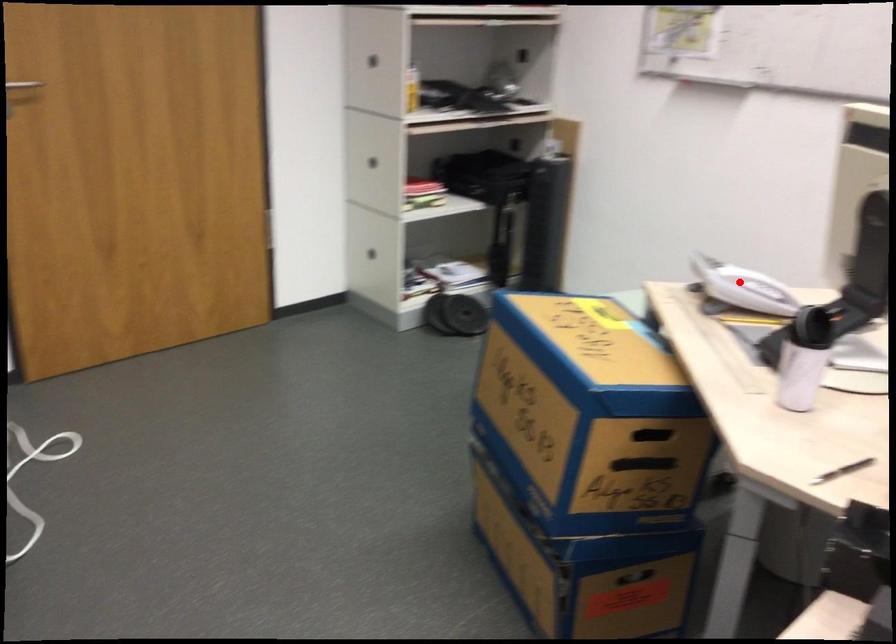
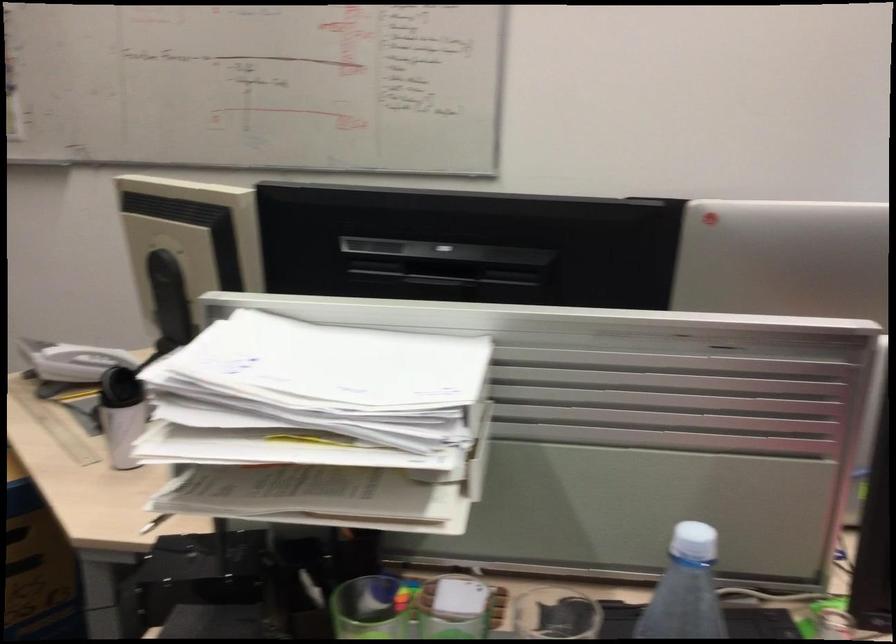
Where in the second image is the point corresponding to the highlighted location from the first image?

(72, 361)